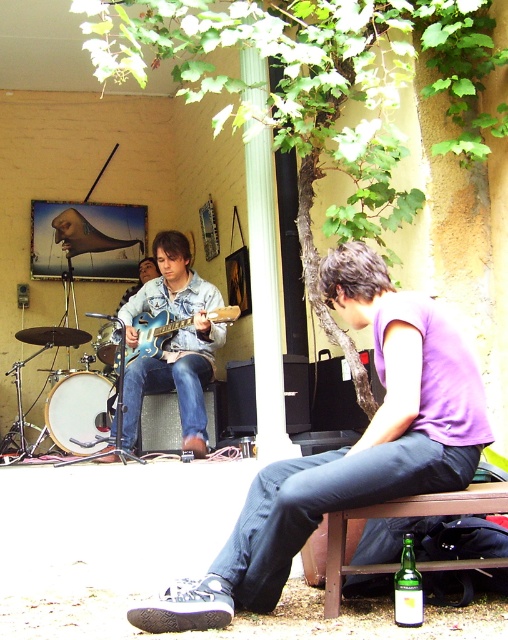
You are a photographer setting up for a live session. You need to position a camera so it can capture both the blue metallic guitar at center and the brushed metal drum at center clearly. Given their heights, which object should you adjust the camera angle to focus on first to ensure both are in frame?

The blue metallic guitar at center is taller than the brushed metal drum at center. To ensure both are in frame, adjust the camera angle to focus on the blue metallic guitar at center first, then position the camera to include the shorter drum.